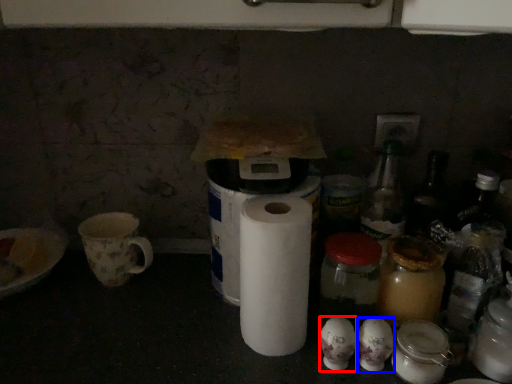
Question: Which object is closer to the camera taking this photo, toilet paper (highlighted by a red box) or toilet paper (highlighted by a blue box)?

Choices:
 (A) toilet paper
 (B) toilet paper

Answer: (B)